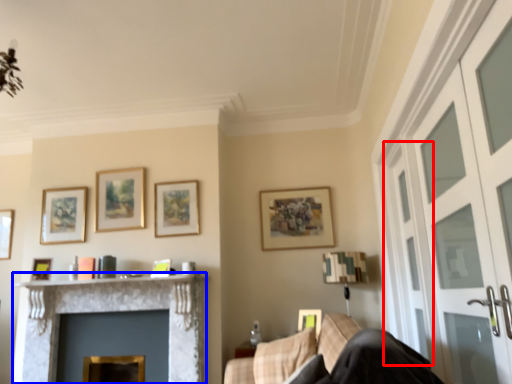
Question: Which of the following is the farthest to the observer, screen door (highlighted by a red box) or fireplace (highlighted by a blue box)?

Choices:
 (A) screen door
 (B) fireplace

Answer: (B)